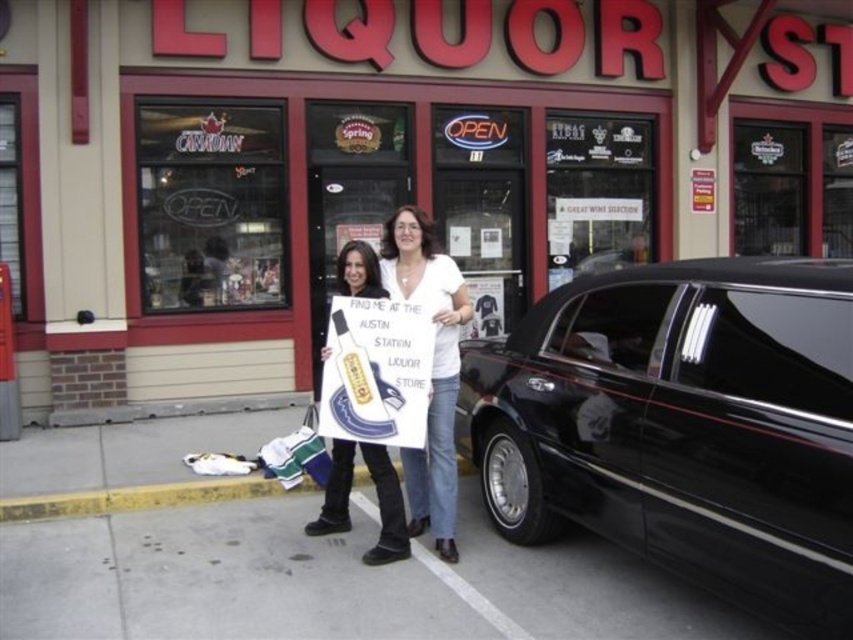
You are a fashion designer observing two people at the liquor store. You notice a person wearing a white cotton shirt at center and denim jeans at center. Which clothing item is positioned higher on their body?

The white cotton shirt at center is positioned higher on their body as it is above the denim jeans at center.

You are a delivery driver who needs to park your vehicle near the liquor store. The parking spot is marked at point (381,166). Can you safely park your car there without blocking the entrance?

The parking spot at point (381,166) is occupied by a matte black car at right, so you cannot park there without blocking the entrance.